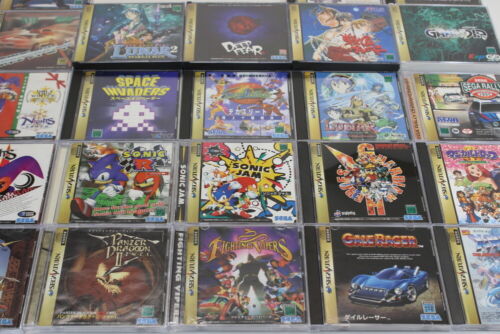
Image resolution: width=500 pixels, height=334 pixels. What are the coordinates of `bottom row of games` in the screenshot? It's located at (15, 257), (97, 274), (246, 276), (390, 282), (490, 269).